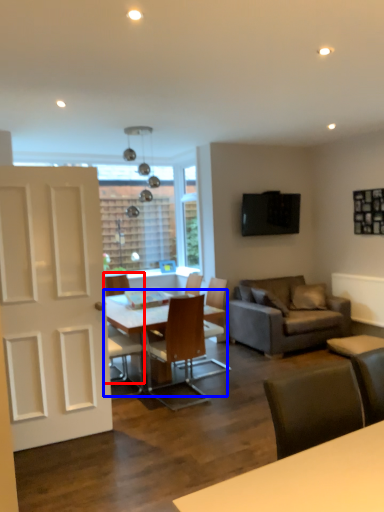
Question: Which of the following is the farthest to the observer, chair (highlighted by a red box) or table (highlighted by a blue box)?

Choices:
 (A) chair
 (B) table

Answer: (A)